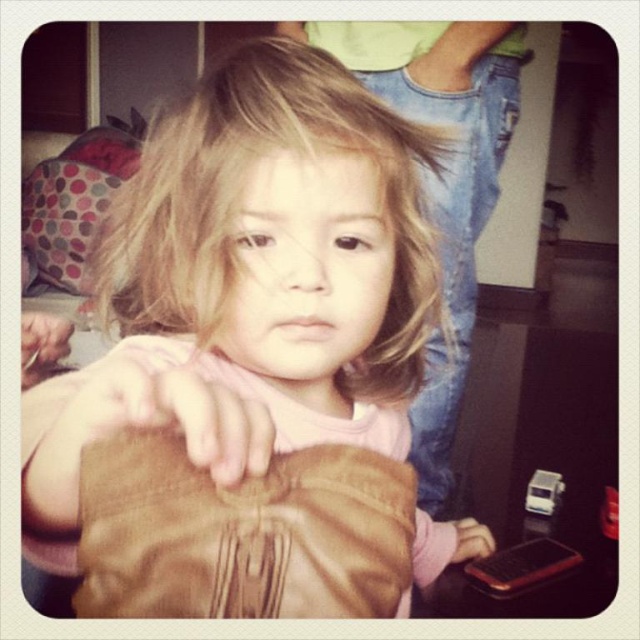
You are a photographer trying to capture a clear shot of the child holding both the matte brown jacket at center and the brown leather handbag at lower right. Since you can only focus on one object at a time, which object should you choose to ensure it appears sharp in the photo?

The matte brown jacket at center is closer to the viewer than the brown leather handbag at lower right, so focusing on the matte brown jacket at center will ensure it appears sharp while the handbag may be slightly out of focus. Alternatively, focusing on the handbag might leave the jacket blurry. To prioritize the closer object for sharpness, choose the matte brown jacket at center.

In the scene shown: You are a delivery person who needs to place a package in the room. The package is too large to fit through the doorway. You must choose between placing it next to the brown leather handbag at lower left or the brown leather handbag at lower right. Which handbag should you place the package next to to ensure there is enough vertical space?

The brown leather handbag at lower right is shorter than the brown leather handbag at lower left. Since the package is too large to fit through the doorway, placing it next to the brown leather handbag at lower right would provide more vertical space as it is shorter.

In the scene shown: You are a tailor who needs to determine which item requires more fabric to make between the matte brown jacket at center and the leather glove at center. Which one would you choose?

The matte brown jacket at center requires more fabric than the leather glove at center because it has a larger size.